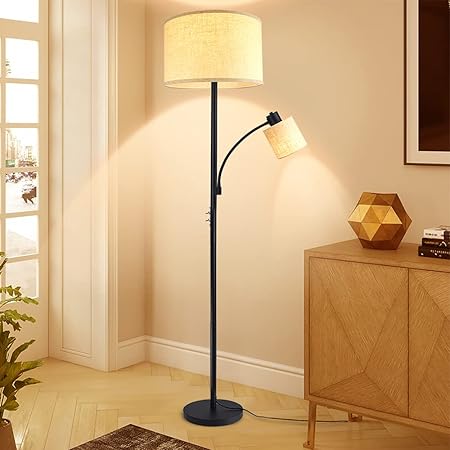
Where is `lamp base`? The height and width of the screenshot is (450, 450). lamp base is located at coordinates (220, 412).